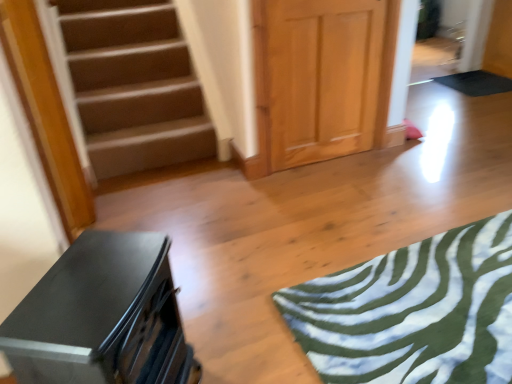
The image size is (512, 384). Identify the location of free space to the right of light wood paneling at center. (401, 163).